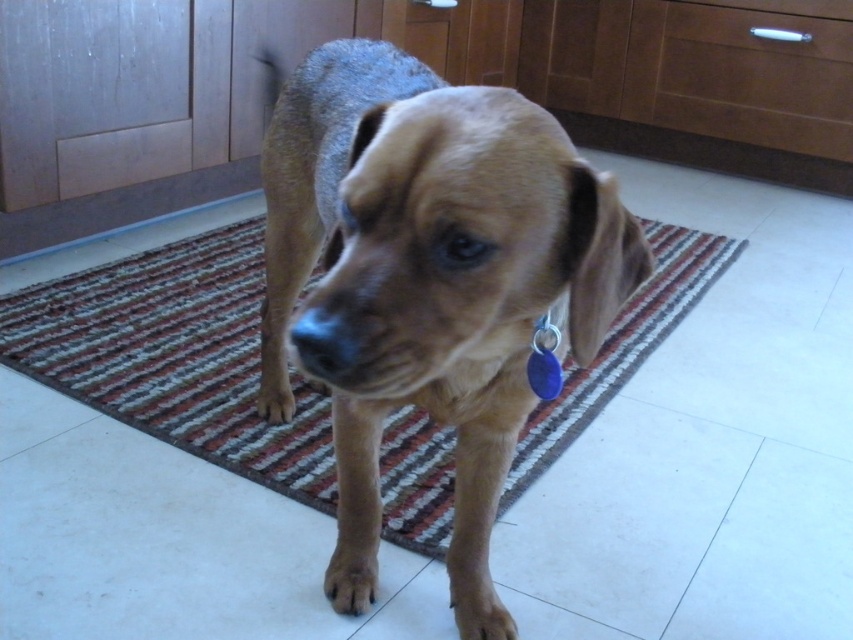
You are trying to clean the brown striped rug at center but need to move the brown matte dog at center first. Can you step around the dog to access the rug without moving it?

The brown matte dog at center is in front of the brown striped rug at center, so you can step around the dog to access the rug since the dog is not blocking the entire area.

You are trying to decide whether to place a small decorative item on the brown striped rug at center. Considering the size of the brown matte dog at center, will the dog be able to step over the rug without touching it?

The brown matte dog at center is much taller than the brown striped rug at center, so the dog can easily step over the rug without touching it.